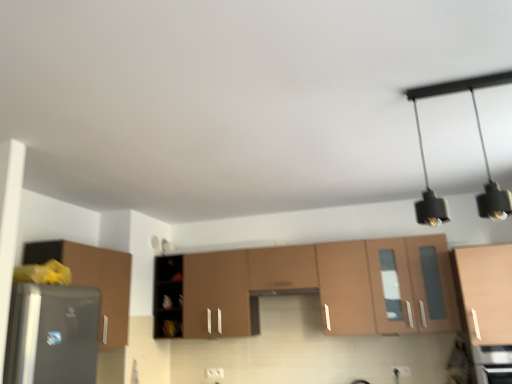
The width and height of the screenshot is (512, 384). Describe the element at coordinates (485, 292) in the screenshot. I see `matte wood cabinet at right, which ranks as the third cabinetry in left-to-right order` at that location.

Locate an element on the screen. The height and width of the screenshot is (384, 512). black matte light fixture at upper right is located at coordinates (482, 149).

I want to click on matte brown cabinet at center, the 2th cabinetry viewed from the left, so click(312, 287).

At what (x,y) coordinates should I click in order to perform the action: click on matte brown cabinet at left, acting as the first cabinetry starting from the left. Please return your answer as a coordinate pair (x, y). The height and width of the screenshot is (384, 512). Looking at the image, I should click on (94, 281).

Where is `matte wood cabinet at right, which ranks as the first cabinetry in right-to-left order`? The image size is (512, 384). matte wood cabinet at right, which ranks as the first cabinetry in right-to-left order is located at coordinates (485, 292).

Considering the relative sizes of matte brown cabinet at center, the 2th cabinetry viewed from the left, and matte brown cabinet at left, arranged as the 3th cabinetry when viewed from the right, in the image provided, is matte brown cabinet at center, the 2th cabinetry viewed from the left, wider than matte brown cabinet at left, arranged as the 3th cabinetry when viewed from the right,?

Indeed, matte brown cabinet at center, the 2th cabinetry viewed from the left, has a greater width compared to matte brown cabinet at left, arranged as the 3th cabinetry when viewed from the right.

From the image's perspective, is matte brown cabinet at center, arranged as the 2th cabinetry when viewed from the right, located above or below matte brown cabinet at left, acting as the first cabinetry starting from the left?

matte brown cabinet at center, arranged as the 2th cabinetry when viewed from the right, is situated lower than matte brown cabinet at left, acting as the first cabinetry starting from the left, in the image.

Is matte brown cabinet at center, arranged as the 2th cabinetry when viewed from the right, positioned with its back to matte brown cabinet at left, acting as the first cabinetry starting from the left?

No.

Is matte brown cabinet at left, acting as the first cabinetry starting from the left, facing away from black matte light fixture at upper right?

No, black matte light fixture at upper right is not at the back of matte brown cabinet at left, acting as the first cabinetry starting from the left.

Considering the positions of points (104, 328) and (489, 210), is point (104, 328) closer to camera compared to point (489, 210)?

That is False.

Which is more to the right, matte brown cabinet at left, acting as the first cabinetry starting from the left, or black matte light fixture at upper right?

From the viewer's perspective, black matte light fixture at upper right appears more on the right side.

From their relative heights in the image, would you say matte brown cabinet at left, arranged as the 3th cabinetry when viewed from the right, is taller or shorter than black matte light fixture at upper right?

Considering their sizes, matte brown cabinet at left, arranged as the 3th cabinetry when viewed from the right, has more height than black matte light fixture at upper right.

Locate an element on the screen. The width and height of the screenshot is (512, 384). appliance that is in front of the matte wood cabinet at right, which ranks as the first cabinetry in right-to-left order is located at coordinates (493, 363).

Consider the image. Is satin black oven at lower right looking in the opposite direction of matte wood cabinet at right, which ranks as the third cabinetry in left-to-right order?

No, matte wood cabinet at right, which ranks as the third cabinetry in left-to-right order, is not at the back of satin black oven at lower right.

Is satin black oven at lower right in contact with matte wood cabinet at right, which ranks as the first cabinetry in right-to-left order?

There is a gap between satin black oven at lower right and matte wood cabinet at right, which ranks as the first cabinetry in right-to-left order.

Can we say matte brown cabinet at center, the 2th cabinetry viewed from the left, lies outside satin black oven at lower right?

Indeed, matte brown cabinet at center, the 2th cabinetry viewed from the left, is completely outside satin black oven at lower right.

Could you tell me if matte brown cabinet at center, the 2th cabinetry viewed from the left, is turned towards satin black oven at lower right?

No.

Considering their positions, is matte brown cabinet at center, the 2th cabinetry viewed from the left, located in front of or behind satin black oven at lower right?

matte brown cabinet at center, the 2th cabinetry viewed from the left, is behind satin black oven at lower right.

Between matte brown cabinet at center, the 2th cabinetry viewed from the left, and satin black oven at lower right, which one has larger size?

matte brown cabinet at center, the 2th cabinetry viewed from the left, is bigger.

Based on their sizes in the image, would you say black matte light fixture at upper right is bigger or smaller than satin black oven at lower right?

Considering their sizes, black matte light fixture at upper right takes up less space than satin black oven at lower right.

Considering the relative sizes of black matte light fixture at upper right and satin black oven at lower right in the image provided, is black matte light fixture at upper right thinner than satin black oven at lower right?

Yes.

Which is in front, black matte light fixture at upper right or satin black oven at lower right?

black matte light fixture at upper right is closer to the camera.

Considering their positions, is matte brown cabinet at center, arranged as the 2th cabinetry when viewed from the right, located in front of or behind matte wood cabinet at right, which ranks as the first cabinetry in right-to-left order?

matte brown cabinet at center, arranged as the 2th cabinetry when viewed from the right, is behind matte wood cabinet at right, which ranks as the first cabinetry in right-to-left order.

Is matte brown cabinet at center, the 2th cabinetry viewed from the left, smaller than matte wood cabinet at right, which ranks as the third cabinetry in left-to-right order?

Incorrect, matte brown cabinet at center, the 2th cabinetry viewed from the left, is not smaller in size than matte wood cabinet at right, which ranks as the third cabinetry in left-to-right order.

Does point (370, 243) appear closer or farther from the camera than point (461, 285)?

Clearly, point (370, 243) is more distant from the camera than point (461, 285).

How many degrees apart are the facing directions of matte brown cabinet at center, arranged as the 2th cabinetry when viewed from the right, and matte wood cabinet at right, which ranks as the third cabinetry in left-to-right order?

3.33e-05 degrees.

At what (x,y) coordinates should I click in order to perform the action: click on light fixture that appears above the matte wood cabinet at right, which ranks as the third cabinetry in left-to-right order (from the image's perspective). Please return your answer as a coordinate pair (x, y). The image size is (512, 384). Looking at the image, I should click on (482, 149).

Does black matte light fixture at upper right have a larger size compared to matte wood cabinet at right, which ranks as the third cabinetry in left-to-right order?

No, black matte light fixture at upper right is not bigger than matte wood cabinet at right, which ranks as the third cabinetry in left-to-right order.

Is black matte light fixture at upper right far from matte wood cabinet at right, which ranks as the third cabinetry in left-to-right order?

Actually, black matte light fixture at upper right and matte wood cabinet at right, which ranks as the third cabinetry in left-to-right order, are a little close together.

Is black matte light fixture at upper right turned away from matte wood cabinet at right, which ranks as the third cabinetry in left-to-right order?

black matte light fixture at upper right is not turned away from matte wood cabinet at right, which ranks as the third cabinetry in left-to-right order.

Where is `cabinetry that is the 2nd one when counting forward from the matte brown cabinet at center, the 2th cabinetry viewed from the left`? This screenshot has height=384, width=512. cabinetry that is the 2nd one when counting forward from the matte brown cabinet at center, the 2th cabinetry viewed from the left is located at coordinates (94, 281).

Where is `light fixture on the right of matte brown cabinet at left, acting as the first cabinetry starting from the left`? The image size is (512, 384). light fixture on the right of matte brown cabinet at left, acting as the first cabinetry starting from the left is located at coordinates (482, 149).

Estimate the real-world distances between objects in this image. Which object is further from matte brown cabinet at left, arranged as the 3th cabinetry when viewed from the right, matte brown cabinet at center, arranged as the 2th cabinetry when viewed from the right, or satin black oven at lower right?

Among the two, satin black oven at lower right is located further to matte brown cabinet at left, arranged as the 3th cabinetry when viewed from the right.

From the image, which object appears to be nearer to matte brown cabinet at left, acting as the first cabinetry starting from the left, matte brown cabinet at center, arranged as the 2th cabinetry when viewed from the right, or matte wood cabinet at right, which ranks as the first cabinetry in right-to-left order?

matte brown cabinet at center, arranged as the 2th cabinetry when viewed from the right, lies closer to matte brown cabinet at left, acting as the first cabinetry starting from the left, than the other object.

Estimate the real-world distances between objects in this image. Which object is closer to matte brown cabinet at left, arranged as the 3th cabinetry when viewed from the right, matte wood cabinet at right, which ranks as the first cabinetry in right-to-left order, or matte brown cabinet at center, the 2th cabinetry viewed from the left?

matte brown cabinet at center, the 2th cabinetry viewed from the left, is closer to matte brown cabinet at left, arranged as the 3th cabinetry when viewed from the right.

Estimate the real-world distances between objects in this image. Which object is further from matte wood cabinet at right, which ranks as the third cabinetry in left-to-right order, satin black oven at lower right or matte brown cabinet at left, arranged as the 3th cabinetry when viewed from the right?

The object further to matte wood cabinet at right, which ranks as the third cabinetry in left-to-right order, is matte brown cabinet at left, arranged as the 3th cabinetry when viewed from the right.

Which object lies nearer to the anchor point satin black oven at lower right, black matte light fixture at upper right or matte wood cabinet at right, which ranks as the first cabinetry in right-to-left order?

matte wood cabinet at right, which ranks as the first cabinetry in right-to-left order, is closer to satin black oven at lower right.

Based on their spatial positions, is matte brown cabinet at left, arranged as the 3th cabinetry when viewed from the right, or black matte light fixture at upper right closer to matte brown cabinet at center, the 2th cabinetry viewed from the left?

matte brown cabinet at left, arranged as the 3th cabinetry when viewed from the right, is positioned closer to the anchor matte brown cabinet at center, the 2th cabinetry viewed from the left.

Estimate the real-world distances between objects in this image. Which object is closer to black matte light fixture at upper right, satin black oven at lower right or matte brown cabinet at center, the 2th cabinetry viewed from the left?

satin black oven at lower right is closer to black matte light fixture at upper right.

Considering their positions, is satin black oven at lower right positioned closer to matte wood cabinet at right, which ranks as the third cabinetry in left-to-right order, than black matte light fixture at upper right?

satin black oven at lower right is positioned closer to the anchor matte wood cabinet at right, which ranks as the third cabinetry in left-to-right order.

You are a GUI agent. You are given a task and a screenshot of the screen. Output one action in this format:
    pyautogui.click(x=<x>, y=<y>)
    Task: Click on the cabinetry situated between matte brown cabinet at left, acting as the first cabinetry starting from the left, and matte wood cabinet at right, which ranks as the first cabinetry in right-to-left order, from left to right
    This screenshot has height=384, width=512.
    Given the screenshot: What is the action you would take?
    pyautogui.click(x=312, y=287)

The height and width of the screenshot is (384, 512). I want to click on appliance positioned between black matte light fixture at upper right and matte brown cabinet at center, the 2th cabinetry viewed from the left, from near to far, so click(493, 363).

Find the location of a particular element. cabinetry between matte brown cabinet at left, acting as the first cabinetry starting from the left, and satin black oven at lower right from left to right is located at coordinates (312, 287).

You are a GUI agent. You are given a task and a screenshot of the screen. Output one action in this format:
    pyautogui.click(x=<x>, y=<y>)
    Task: Click on the light fixture between matte brown cabinet at left, arranged as the 3th cabinetry when viewed from the right, and satin black oven at lower right from left to right
    Image resolution: width=512 pixels, height=384 pixels.
    Given the screenshot: What is the action you would take?
    pyautogui.click(x=482, y=149)